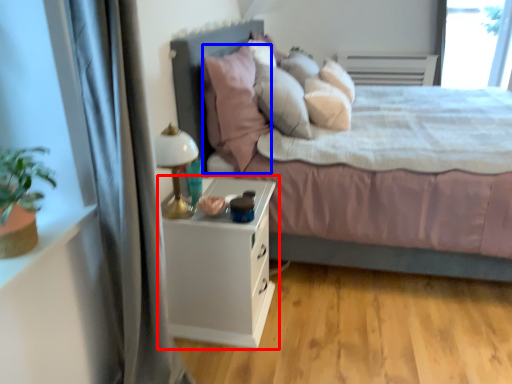
Question: Among these objects, which one is farthest to the camera, nightstand (highlighted by a red box) or pillow (highlighted by a blue box)?

Choices:
 (A) nightstand
 (B) pillow

Answer: (B)